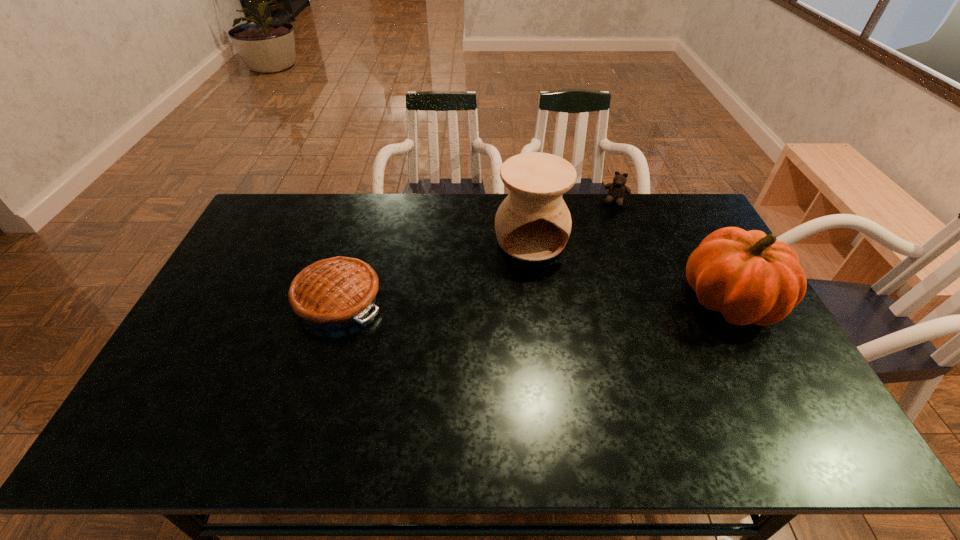
This screenshot has width=960, height=540. What are the coordinates of `vacant space on the desktop that is between the pie and the rightmost object and is positioned at the open side of the pottery` in the screenshot? It's located at (548, 300).

Find the location of a particular element. The height and width of the screenshot is (540, 960). vacant space on the desktop that is between the leftmost object and the pumpkin and is positioned on the face of the farthest object is located at coordinates (581, 300).